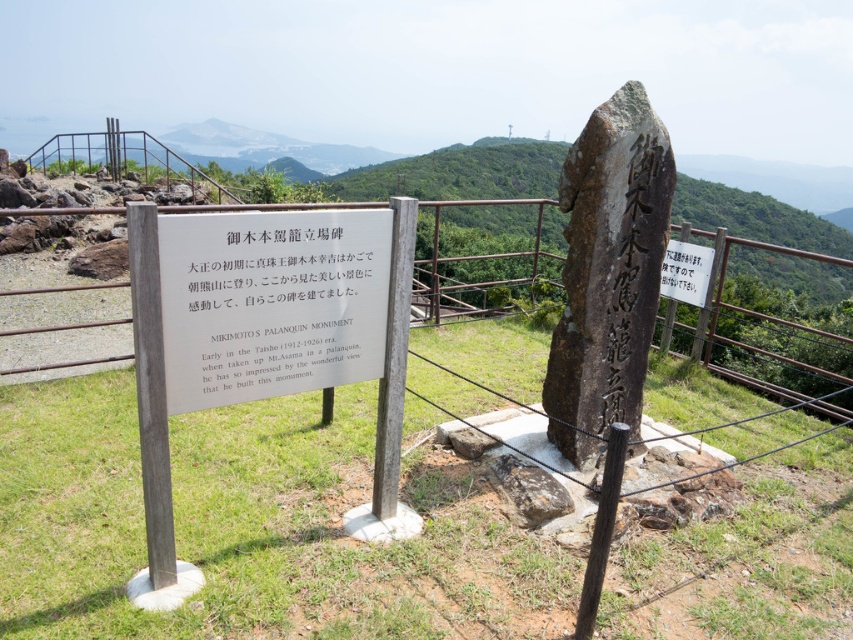
Question: Which of the following is the farthest from the observer?

Choices:
 (A) white paper sign at center
 (B) metallic silver fence at upper center

Answer: (B)

Question: Which is farther from the white paper sign at center?

Choices:
 (A) white paper at center
 (B) metallic silver fence at upper center

Answer: (B)

Question: Is white paper at center thinner than white paper sign at upper center?

Choices:
 (A) yes
 (B) no

Answer: (B)

Question: Can you confirm if white paper at center is positioned below white paper sign at upper center?

Choices:
 (A) no
 (B) yes

Answer: (B)

Question: Which of the following is the closest to the observer?

Choices:
 (A) white paper at center
 (B) white paper sign at upper center
 (C) white paper sign at center
 (D) metallic silver fence at upper center

Answer: (C)

Question: Is white paper at center bigger than white paper sign at upper center?

Choices:
 (A) no
 (B) yes

Answer: (B)